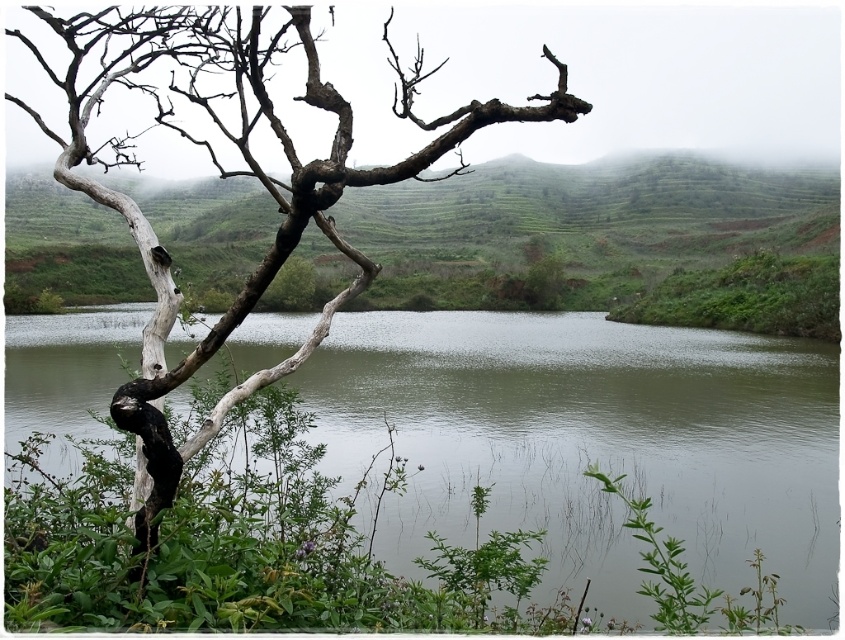
You are a bird flying over the landscape and want to land on the green smooth water at center. However, you notice the white rough branch at left. Which object is closer to the sky, making it a safer landing spot?

The white rough branch at left is closer to the sky than the green smooth water at center, so it is a safer landing spot.

You are standing on the dock and want to reach the green grassy hillside at upper center. Which direction should you move to get there from the green smooth water at center?

To reach the green grassy hillside at upper center from the green smooth water at center, you should move upward since the green grassy hillside at upper center is positioned above the green smooth water at center.

You are a painter standing at the edge of the scene and want to paint the green smooth water at center and the white rough branch at left. Which object will you need to paint with a wider brush stroke?

The white rough branch at left requires a wider brush stroke because it has a greater width than the green smooth water at center.